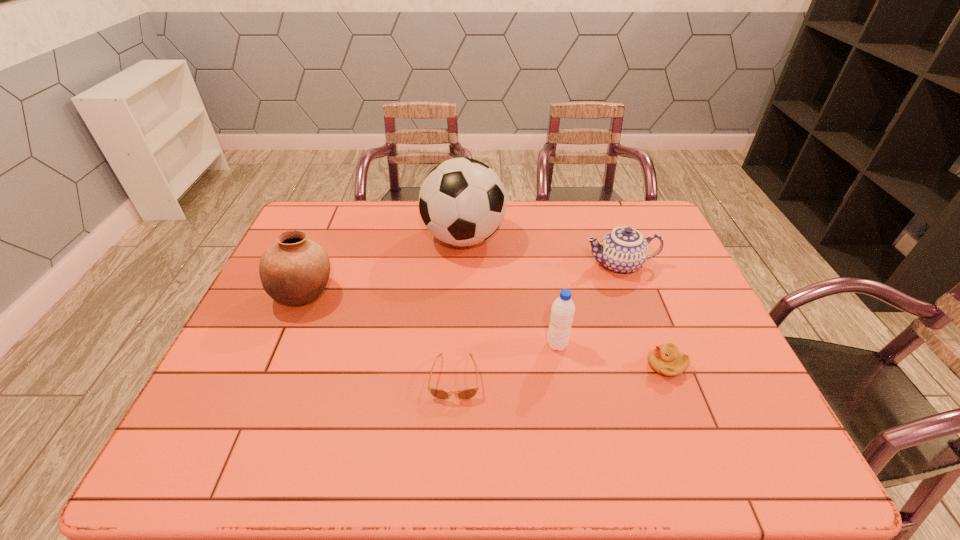
Identify the location of vacant region between the duckling and the water bottle. (612, 355).

Find the location of a particular element. This screenshot has height=540, width=960. free area in between the sunglasses and the pottery is located at coordinates (380, 335).

What are the coordinates of `empty location between the fourth tallest object and the duckling` in the screenshot? It's located at (643, 315).

I want to click on vacant space that is in between the chinaware and the sunglasses, so click(537, 321).

The width and height of the screenshot is (960, 540). What are the coordinates of `vacant space that is in between the fifth tallest object and the shortest object` in the screenshot? It's located at (561, 372).

Identify which object is the fifth nearest to the fourth object from left to right. Please provide its 2D coordinates. Your answer should be formatted as a tuple, i.e. [(x, y)], where the tuple contains the x and y coordinates of a point satisfying the conditions above.

[(295, 270)]

Image resolution: width=960 pixels, height=540 pixels. Identify the location of the fourth closest object to the sunglasses. (666, 360).

In order to click on vacant area in the image that satisfies the following two spatial constraints: 1. from the spout of the third shortest object; 2. on the front-facing side of the shortest object in this screenshot , I will do `click(660, 377)`.